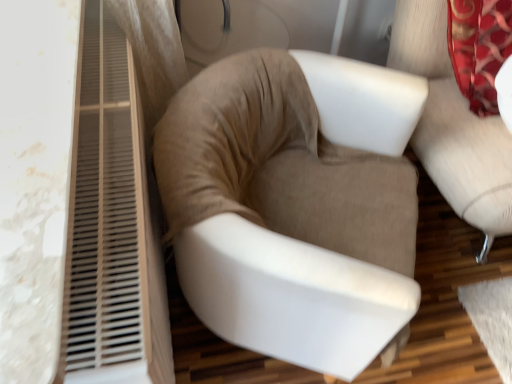
Question: Which direction should I rotate to face suede beige armchair at center, the 1th chair positioned from the right, — up or down?

Choices:
 (A) down
 (B) up

Answer: (B)

Question: Which direction should I rotate to look at suede-like beige chair at center, the first chair positioned from the left?

Choices:
 (A) right
 (B) left

Answer: (A)

Question: Is suede beige armchair at center, the 1th chair positioned from the right, bigger than suede-like beige chair at center, the first chair positioned from the left?

Choices:
 (A) yes
 (B) no

Answer: (A)

Question: From the image's perspective, would you say suede beige armchair at center, the 1th chair positioned from the right, is positioned over suede-like beige chair at center, the second chair when ordered from right to left?

Choices:
 (A) yes
 (B) no

Answer: (A)

Question: Does suede beige armchair at center, marked as the 2th chair in a left-to-right arrangement, have a lesser width compared to suede-like beige chair at center, the second chair when ordered from right to left?

Choices:
 (A) yes
 (B) no

Answer: (B)

Question: Can you confirm if suede beige armchair at center, marked as the 2th chair in a left-to-right arrangement, is shorter than suede-like beige chair at center, the first chair positioned from the left?

Choices:
 (A) yes
 (B) no

Answer: (B)

Question: From a real-world perspective, is suede beige armchair at center, marked as the 2th chair in a left-to-right arrangement, over suede-like beige chair at center, the second chair when ordered from right to left?

Choices:
 (A) no
 (B) yes

Answer: (B)

Question: Are suede beige armchair at center, marked as the 2th chair in a left-to-right arrangement, and suede-like beige chair at center, the first chair positioned from the left, located far from each other?

Choices:
 (A) no
 (B) yes

Answer: (A)

Question: Is suede-like beige chair at center, the second chair when ordered from right to left, next to suede beige armchair at center, the 1th chair positioned from the right, and touching it?

Choices:
 (A) no
 (B) yes

Answer: (A)

Question: Would you say suede beige armchair at center, marked as the 2th chair in a left-to-right arrangement, is part of suede-like beige chair at center, the first chair positioned from the left,'s contents?

Choices:
 (A) no
 (B) yes

Answer: (A)

Question: Can you confirm if suede-like beige chair at center, the first chair positioned from the left, is positioned to the left of suede beige armchair at center, marked as the 2th chair in a left-to-right arrangement?

Choices:
 (A) yes
 (B) no

Answer: (A)

Question: From the image's perspective, is suede-like beige chair at center, the first chair positioned from the left, located beneath suede beige armchair at center, the 1th chair positioned from the right?

Choices:
 (A) yes
 (B) no

Answer: (A)

Question: Can you confirm if suede-like beige chair at center, the first chair positioned from the left, is thinner than suede beige armchair at center, the 1th chair positioned from the right?

Choices:
 (A) no
 (B) yes

Answer: (B)

Question: Is suede-like beige chair at center, the second chair when ordered from right to left, oriented away from suede beige armchair at center, the 1th chair positioned from the right?

Choices:
 (A) yes
 (B) no

Answer: (B)

Question: Is suede beige armchair at center, the 1th chair positioned from the right, wider or thinner than suede-like beige chair at center, the second chair when ordered from right to left?

Choices:
 (A) thin
 (B) wide

Answer: (B)